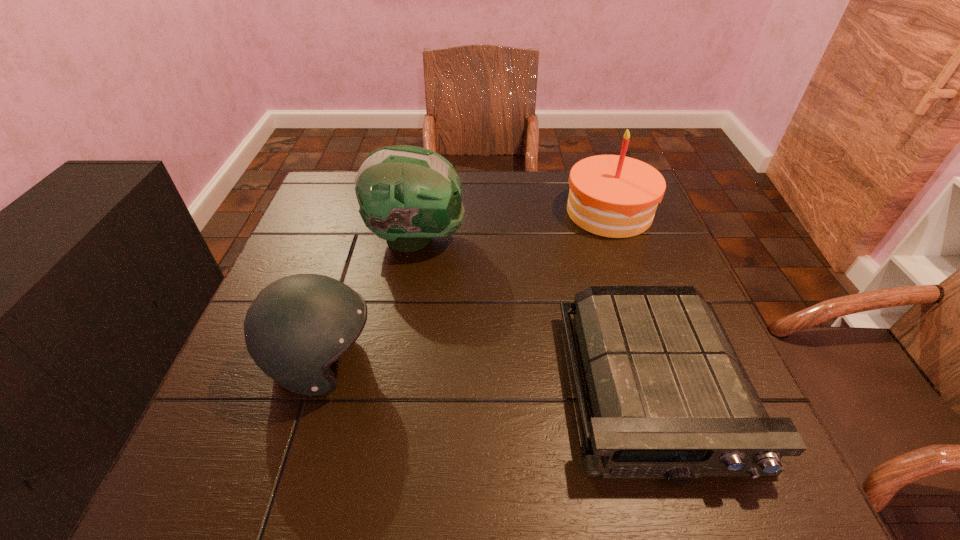
Choose which object is the second nearest neighbor to the shorter football helmet. Please provide its 2D coordinates. Your answer should be formatted as a tuple, i.e. [(x, y)], where the tuple contains the x and y coordinates of a point satisfying the conditions above.

[(670, 398)]

The width and height of the screenshot is (960, 540). I want to click on object that stands as the closest to the birthday cake, so click(670, 398).

Locate an element on the screen. The height and width of the screenshot is (540, 960). vacant position in the image that satisfies the following two spatial constraints: 1. on the front side of the birthday cake; 2. on the visor of the taller football helmet is located at coordinates (618, 239).

Locate an element on the screen. blank area in the image that satisfies the following two spatial constraints: 1. on the front side of the birthday cake; 2. on the visor of the farther football helmet is located at coordinates (618, 239).